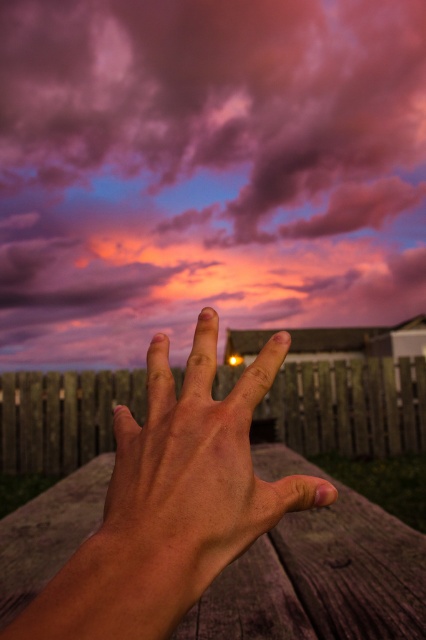
Question: Which point appears closest to the camera in this image?

Choices:
 (A) (157, 410)
 (B) (305, 582)

Answer: (A)

Question: Based on their relative distances, which object is farther from the pink cotton candy cloud at upper center?

Choices:
 (A) wooden picnic table at center
 (B) smooth skin hand at center

Answer: (B)

Question: Can you confirm if pink cotton candy cloud at upper center is thinner than wooden picnic table at center?

Choices:
 (A) no
 (B) yes

Answer: (A)

Question: Which of the following is the farthest from the observer?

Choices:
 (A) smooth skin hand at center
 (B) pink cotton candy cloud at upper center
 (C) wooden picnic table at center

Answer: (C)

Question: Does pink cotton candy cloud at upper center appear on the left side of smooth skin hand at center?

Choices:
 (A) yes
 (B) no

Answer: (A)

Question: Does pink cotton candy cloud at upper center appear over wooden picnic table at center?

Choices:
 (A) no
 (B) yes

Answer: (B)